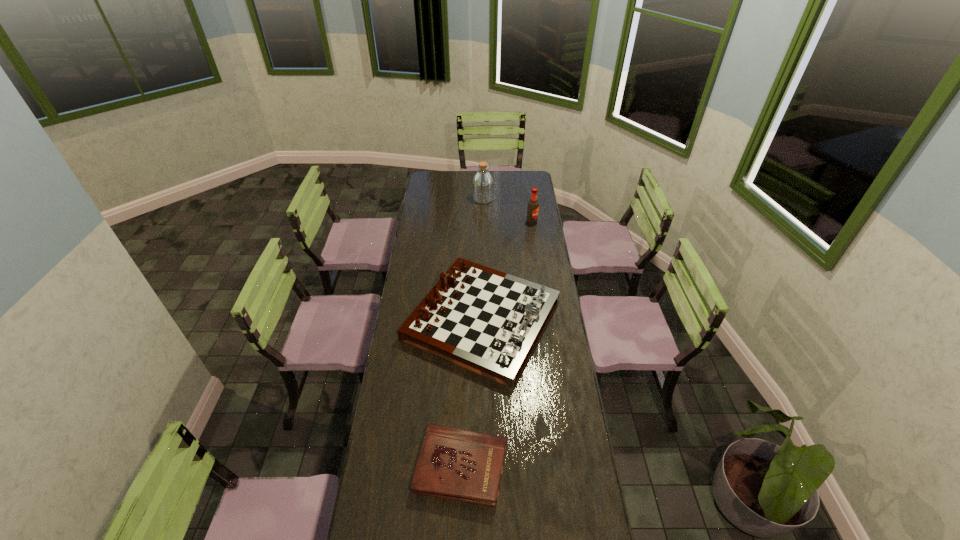
Where is `vacant area that lies between the bottle and the third nearest object`? This screenshot has width=960, height=540. vacant area that lies between the bottle and the third nearest object is located at coordinates (507, 211).

Where is `vacant region between the hardback book and the third farthest object`? This screenshot has width=960, height=540. vacant region between the hardback book and the third farthest object is located at coordinates click(471, 393).

The image size is (960, 540). I want to click on object that is the third closest to the shortest object, so click(x=482, y=184).

Where is `object that is the closest one to the gameboard`? object that is the closest one to the gameboard is located at coordinates (457, 464).

Find the location of `vacant space that satisfies the following two spatial constraints: 1. on the back side of the nearest object; 2. on the right side of the bottle`. vacant space that satisfies the following two spatial constraints: 1. on the back side of the nearest object; 2. on the right side of the bottle is located at coordinates (469, 199).